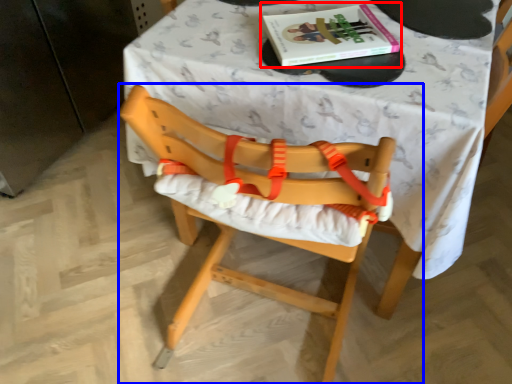
Question: Which object appears farthest to the camera in this image, book (highlighted by a red box) or chair (highlighted by a blue box)?

Choices:
 (A) book
 (B) chair

Answer: (A)